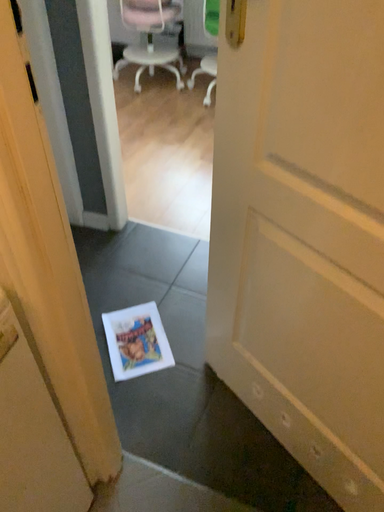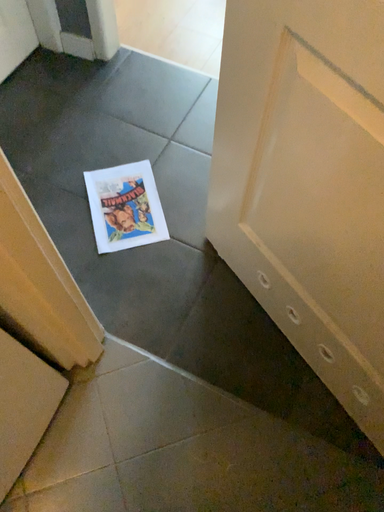
Question: Which way did the camera rotate in the video?

Choices:
 (A) rotated upward
 (B) rotated downward

Answer: (B)